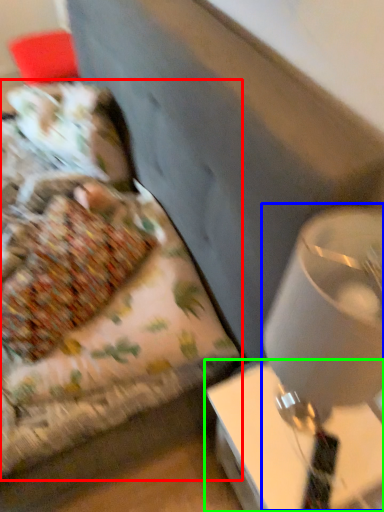
Question: Which object is positioned closest to bed (highlighted by a red box)? Select from table lamp (highlighted by a blue box) and table (highlighted by a green box).

Choices:
 (A) table lamp
 (B) table

Answer: (B)